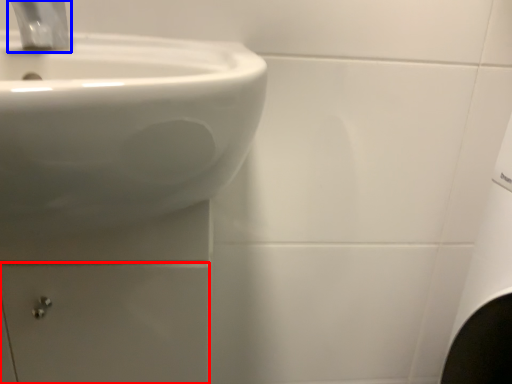
Question: Which point is further to the camera, drawer (highlighted by a red box) or tap (highlighted by a blue box)?

Choices:
 (A) drawer
 (B) tap

Answer: (A)